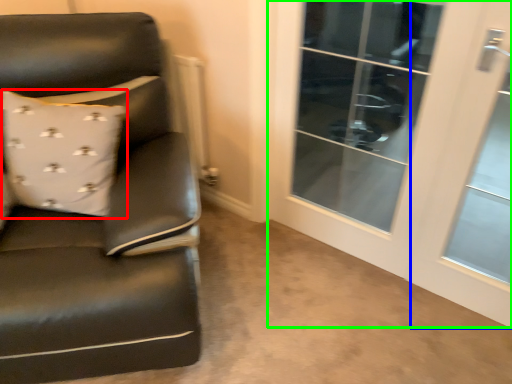
Question: Estimate the real-world distances between objects in this image. Which object is closer to pillow (highlighted by a red box), screen door (highlighted by a blue box) or screen door (highlighted by a green box)?

Choices:
 (A) screen door
 (B) screen door

Answer: (B)